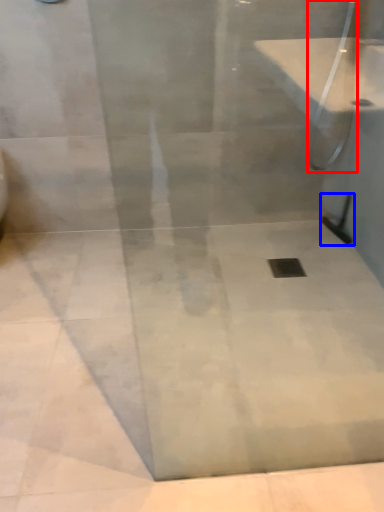
Question: Among these objects, which one is farthest to the camera, shower (highlighted by a red box) or shower (highlighted by a blue box)?

Choices:
 (A) shower
 (B) shower

Answer: (B)